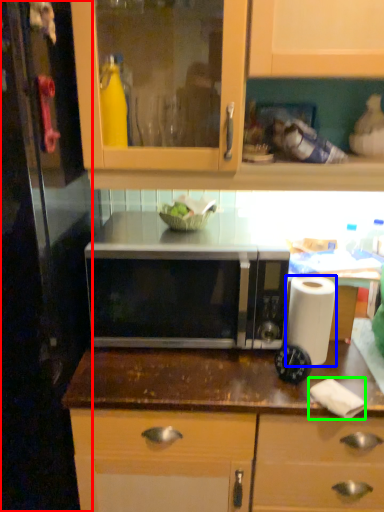
Question: Which object is the farthest from glass door (highlighted by a red box)? Choose among these: paper towel (highlighted by a blue box) or toilet paper (highlighted by a green box).

Choices:
 (A) paper towel
 (B) toilet paper

Answer: (B)